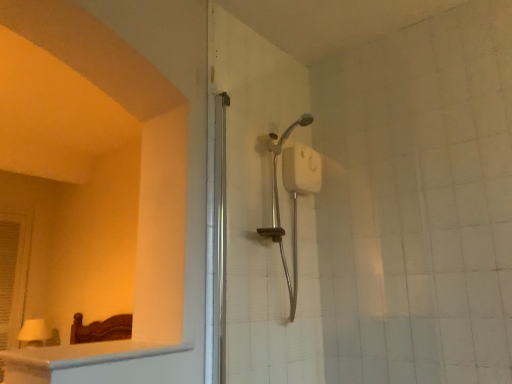
Question: Should I look upward or downward to see white plastic window at left?

Choices:
 (A) down
 (B) up

Answer: (A)